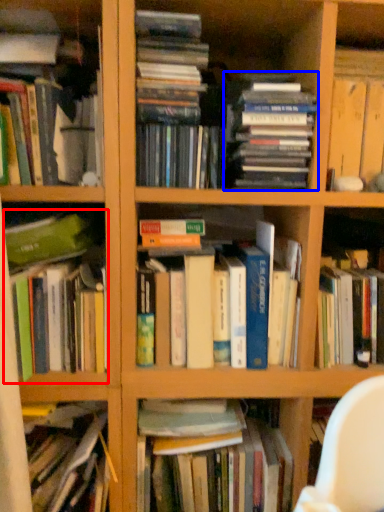
Question: Which object is closer to the camera taking this photo, book (highlighted by a red box) or book (highlighted by a blue box)?

Choices:
 (A) book
 (B) book

Answer: (B)